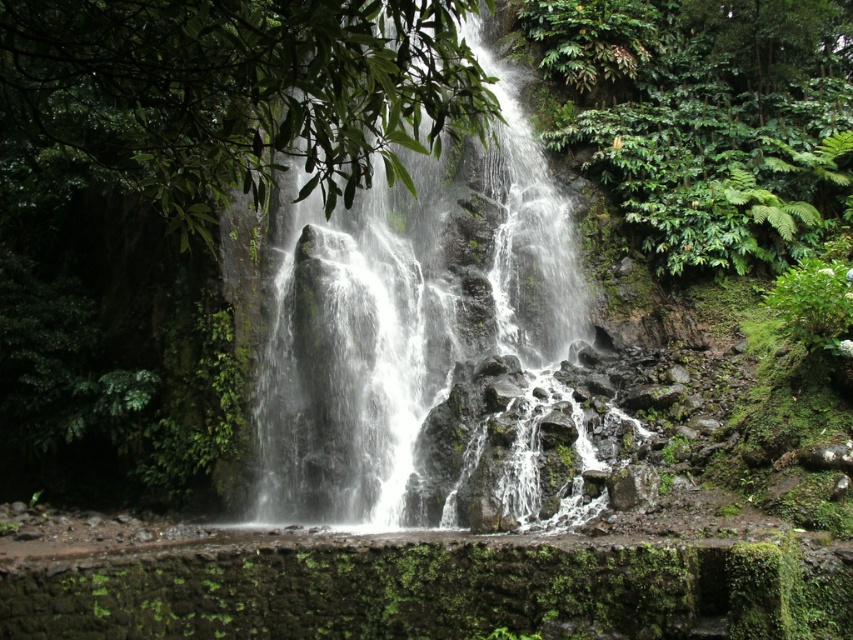
Question: Can you confirm if white frothy water at center is positioned to the left of green leafy foliage at center?

Choices:
 (A) yes
 (B) no

Answer: (B)

Question: Does white frothy water at center appear under green leafy foliage at center?

Choices:
 (A) yes
 (B) no

Answer: (A)

Question: Among these objects, which one is farthest from the camera?

Choices:
 (A) white frothy water at center
 (B) green leafy foliage at center

Answer: (A)

Question: Does white frothy water at center have a smaller size compared to green leafy foliage at center?

Choices:
 (A) yes
 (B) no

Answer: (B)